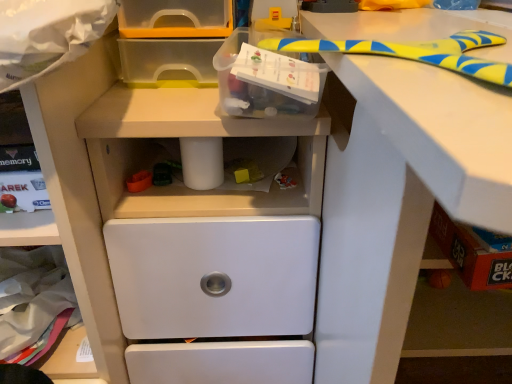
Question: Based on their sizes in the image, would you say white plastic drawer at lower center is bigger or smaller than white plastic workbench at center?

Choices:
 (A) big
 (B) small

Answer: (B)

Question: Is point (41, 119) closer or farther from the camera than point (233, 130)?

Choices:
 (A) farther
 (B) closer

Answer: (B)

Question: Based on their relative distances, which object is farther from the translucent plastic box at upper center?

Choices:
 (A) white plastic workbench at center
 (B) white plastic drawer at lower center

Answer: (B)

Question: Which object is the closest to the translucent plastic box at upper center?

Choices:
 (A) white plastic workbench at center
 (B) white plastic drawer at lower center

Answer: (A)